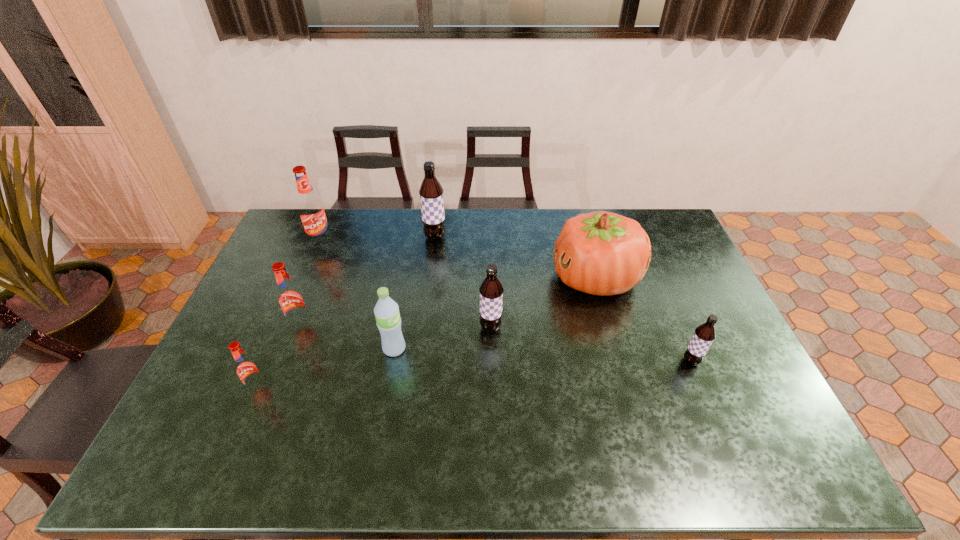
At what (x,y) coordinates should I click in order to perform the action: click on the rightmost brown root beer. Please return your answer as a coordinate pair (x, y). Looking at the image, I should click on [x=704, y=334].

Image resolution: width=960 pixels, height=540 pixels. I want to click on the rightmost root beer, so click(x=704, y=334).

The width and height of the screenshot is (960, 540). I want to click on the nearest red root beer, so click(x=247, y=369).

At what (x,y) coordinates should I click in order to perform the action: click on the nearest root beer. Please return your answer as a coordinate pair (x, y). Looking at the image, I should click on (247, 369).

At what (x,y) coordinates should I click in order to perform the action: click on vacant space located 0.100m on the back of the biggest red root beer. Please return your answer as a coordinate pair (x, y). Looking at the image, I should click on (330, 219).

The width and height of the screenshot is (960, 540). Identify the location of free space located on the left of the biggest brown root beer. (380, 237).

Find the location of a particular element. The width and height of the screenshot is (960, 540). free spot located on the side of the pumpkin with the cute face is located at coordinates (489, 278).

You are a GUI agent. You are given a task and a screenshot of the screen. Output one action in this format:
    pyautogui.click(x=<x>, y=<y>)
    Task: Click on the free space located 0.330m on the side of the pumpkin with the cute face
    Image resolution: width=960 pixels, height=540 pixels.
    Given the screenshot: What is the action you would take?
    pyautogui.click(x=452, y=278)

Find the location of a particular element. The image size is (960, 540). free region located on the side of the pumpkin with the cute face is located at coordinates (431, 278).

You are a GUI agent. You are given a task and a screenshot of the screen. Output one action in this format:
    pyautogui.click(x=<x>, y=<y>)
    Task: Click on the vacant space located on the front of the second brown root beer from right to left
    Image resolution: width=960 pixels, height=540 pixels.
    Given the screenshot: What is the action you would take?
    pyautogui.click(x=492, y=430)